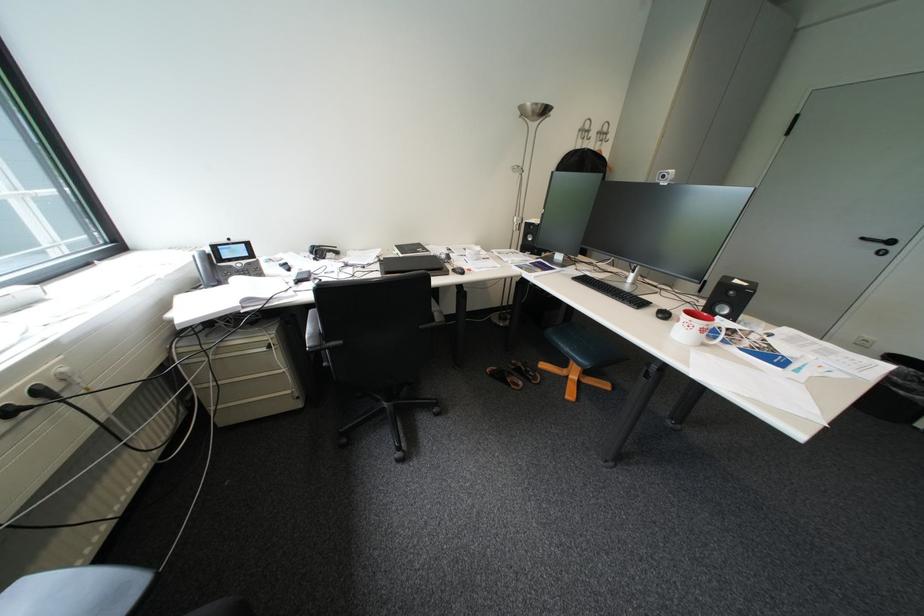
The width and height of the screenshot is (924, 616). In order to click on red and white mug handle in this screenshot , I will do `click(695, 328)`.